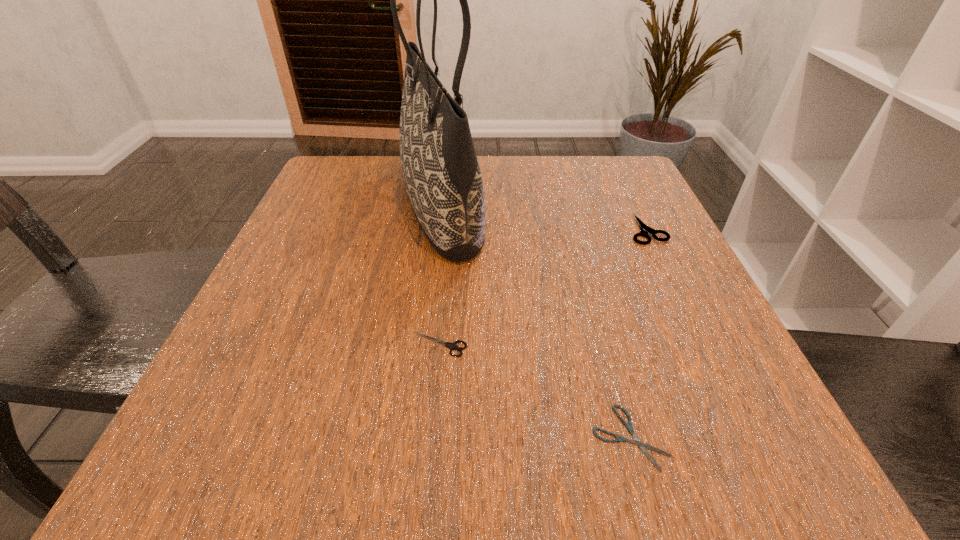
You are a GUI agent. You are given a task and a screenshot of the screen. Output one action in this format:
    pyautogui.click(x=<x>, y=<y>)
    Task: Click on the tote bag
    The height and width of the screenshot is (540, 960).
    Given the screenshot: What is the action you would take?
    pyautogui.click(x=441, y=172)

At what (x,y) coordinates should I click in order to perform the action: click on the tallest shears. Please return your answer as a coordinate pair (x, y). Looking at the image, I should click on (644, 229).

Where is `the rightmost object`? The image size is (960, 540). the rightmost object is located at coordinates (644, 229).

Locate an element on the screen. the third tallest object is located at coordinates (451, 345).

Identify the location of the second tallest shears. (451, 345).

Where is `the shortest object`? the shortest object is located at coordinates (643, 446).

Locate an element on the screen. Image resolution: width=960 pixels, height=540 pixels. the second shears from left to right is located at coordinates (643, 446).

At what (x,y) coordinates should I click in order to perform the action: click on vacant space located on the left of the tote bag. Please return your answer as a coordinate pair (x, y). The image size is (960, 540). Looking at the image, I should click on (317, 207).

Locate an element on the screen. This screenshot has width=960, height=540. vacant position located 0.370m on the front of the third shortest object is located at coordinates (738, 422).

Where is `blank area located 0.360m on the back of the second shortest shears`? blank area located 0.360m on the back of the second shortest shears is located at coordinates (452, 205).